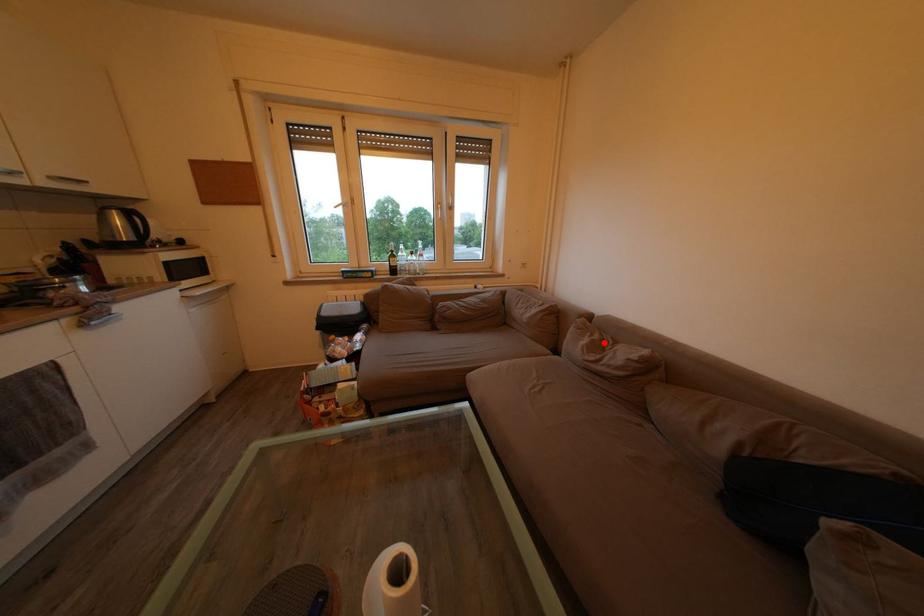
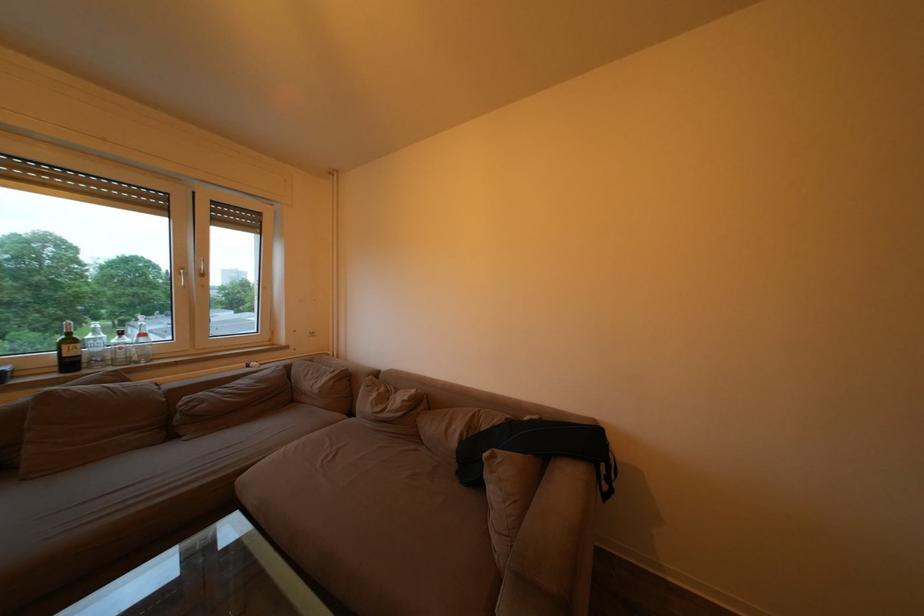
Where in the second image is the point corresponding to the highlighted location from the first image?

(390, 395)